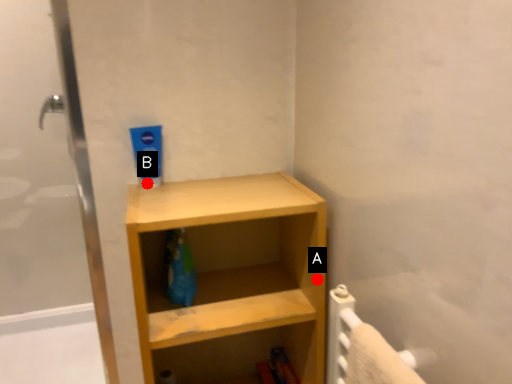
Question: Two points are circled on the image, labeled by A and B beside each circle. Which point appears farthest from the camera in this image?

Choices:
 (A) A is further
 (B) B is further

Answer: (B)